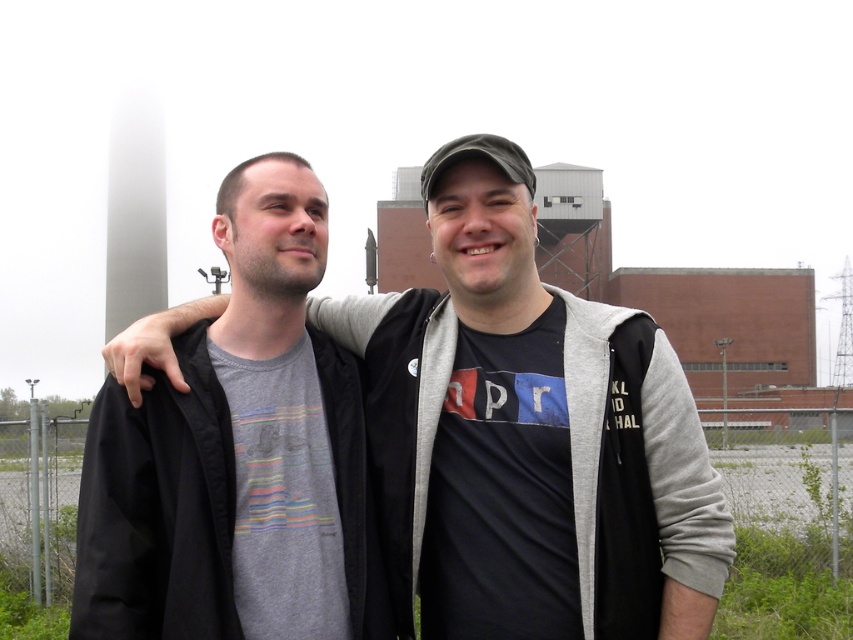
Does gray cotton t-shirt at center appear on the left side of gray cotton sweatshirt at left?

Incorrect, gray cotton t-shirt at center is not on the left side of gray cotton sweatshirt at left.

Is point (451, 380) in front of point (363, 509)?

No, it is behind (363, 509).

Identify the location of gray cotton t-shirt at center. (529, 435).

Where is `gray cotton t-shirt at center`? The height and width of the screenshot is (640, 853). gray cotton t-shirt at center is located at coordinates (529, 435).